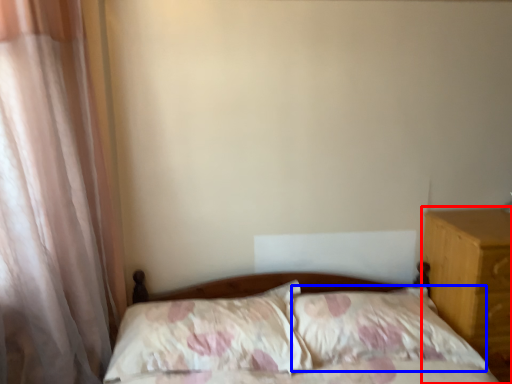
Question: Which point is closer to the camera, nightstand (highlighted by a red box) or pillow (highlighted by a blue box)?

Choices:
 (A) nightstand
 (B) pillow

Answer: (B)